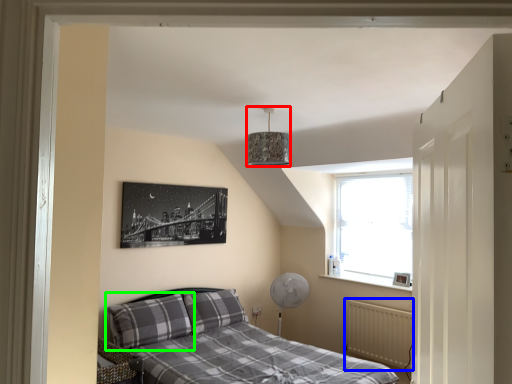
Question: Considering the real-world distances, which object is closest to lamp (highlighted by a red box)? radiator (highlighted by a blue box) or pillow (highlighted by a green box).

Choices:
 (A) radiator
 (B) pillow

Answer: (B)